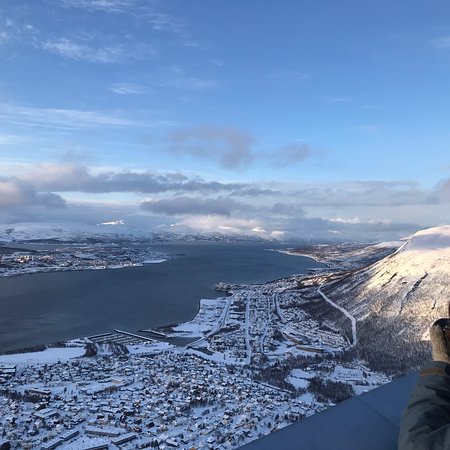
Find the location of a particular element. The height and width of the screenshot is (450, 450). homes is located at coordinates (230, 443), (215, 424), (169, 418), (126, 418).